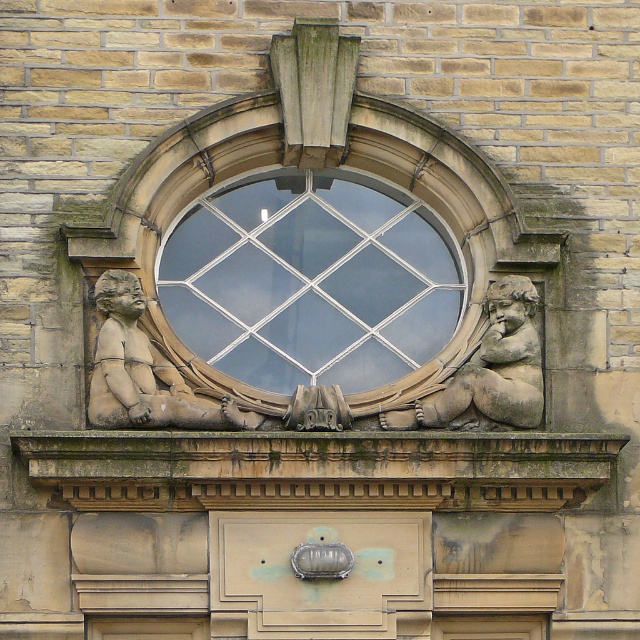
Is stone cherub at center to the right of matte bronze ornament at center from the viewer's perspective?

Correct, you'll find stone cherub at center to the right of matte bronze ornament at center.

Is stone cherub at center taller than matte bronze ornament at center?

Correct, stone cherub at center is much taller as matte bronze ornament at center.

Between point (534, 353) and point (328, 429), which one is positioned in front?

Point (328, 429) is more forward.

Locate an element on the screen. Image resolution: width=640 pixels, height=640 pixels. stone cherub at center is located at coordinates (490, 371).

Describe the element at coordinates (308, 282) in the screenshot. This screenshot has height=640, width=640. I see `clear glass window at center` at that location.

Where is `clear glass window at center`? Image resolution: width=640 pixels, height=640 pixels. clear glass window at center is located at coordinates (308, 282).

Identify the location of clear glass window at center. (308, 282).

Who is taller, clear glass window at center or matte stone cherub at lower left?

With more height is matte stone cherub at lower left.

Is point (364, 259) closer to viewer compared to point (188, 401)?

No, (364, 259) is further to viewer.

Find the location of a particular element. clear glass window at center is located at coordinates (308, 282).